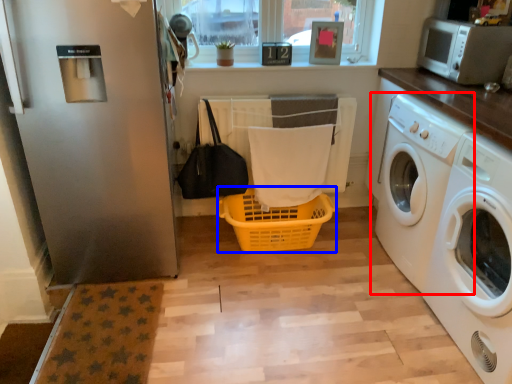
Question: Which of the following is the farthest to the observer, washing machine (highlighted by a red box) or basket (highlighted by a blue box)?

Choices:
 (A) washing machine
 (B) basket

Answer: (B)